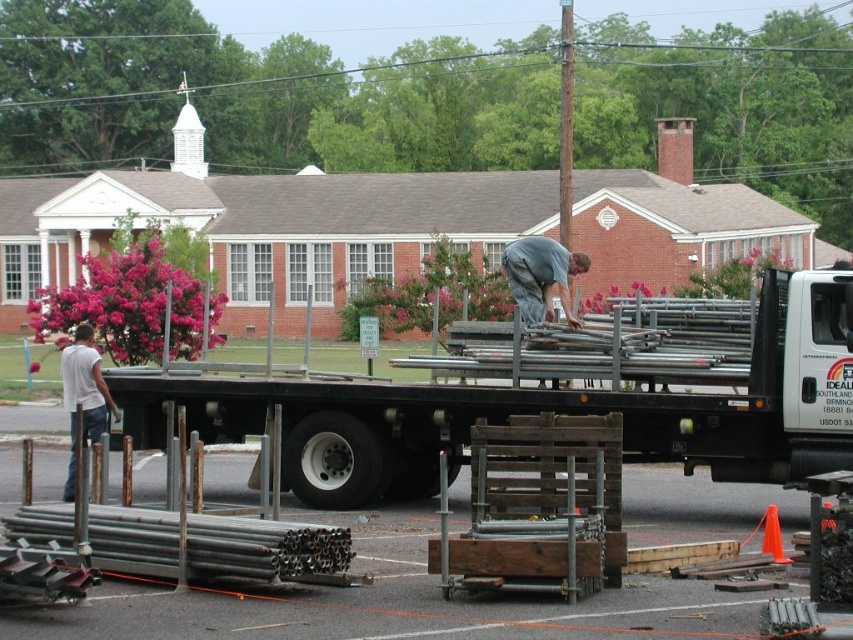
Which is in front, point (769, 362) or point (78, 378)?

Point (769, 362)

This screenshot has width=853, height=640. What are the coordinates of `metallic silver trailer truck at center` in the screenshot? It's located at [x=550, y=403].

Does gray fabric shirt at center appear on the left side of white cotton shirt at left?

In fact, gray fabric shirt at center is to the right of white cotton shirt at left.

Does gray fabric shirt at center lie behind white cotton shirt at left?

Yes, it is.

Who is more forward, (524, 273) or (99, 392)?

Positioned in front is point (99, 392).

Find the location of a particular element. This screenshot has width=853, height=640. gray fabric shirt at center is located at coordinates (540, 276).

Does point (318, 481) lie in front of point (544, 237)?

That is True.

Based on the photo, can you confirm if metallic silver trailer truck at center is positioned to the left of gray fabric shirt at center?

Yes, metallic silver trailer truck at center is to the left of gray fabric shirt at center.

Which is in front, point (285, 428) or point (537, 241)?

Point (285, 428)

The image size is (853, 640). I want to click on metallic silver trailer truck at center, so click(550, 403).